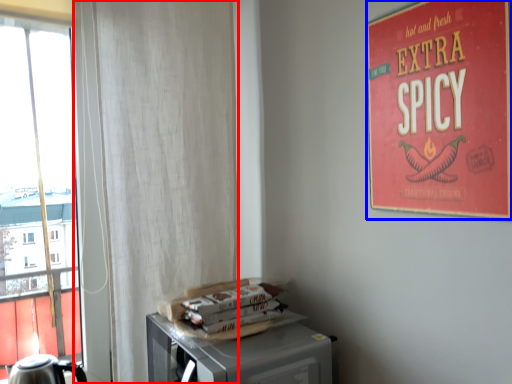
Question: Which object is closer to the camera taking this photo, curtain (highlighted by a red box) or poster (highlighted by a blue box)?

Choices:
 (A) curtain
 (B) poster

Answer: (B)